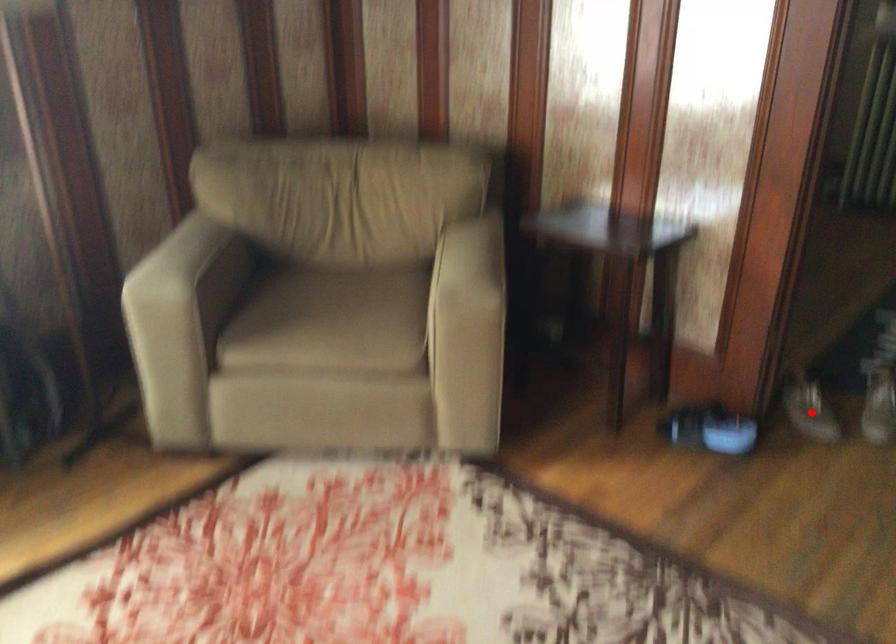
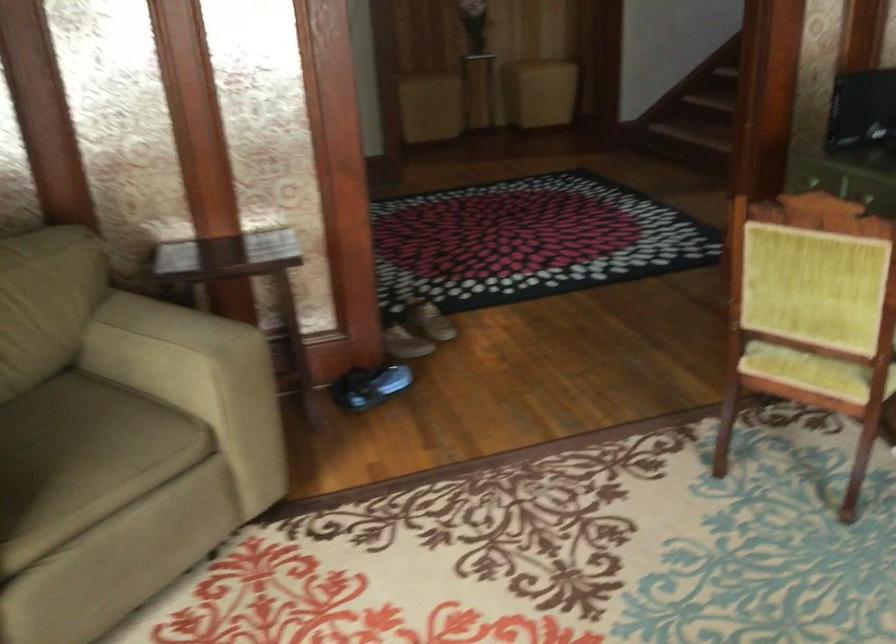
Question: I am providing you with two images of the same scene from different viewpoints. Image1 has a red point marked. In image2, the corresponding 3D location appears at what relative position? Reply with the corresponding letter.

Choices:
 (A) Closer
 (B) Farther

Answer: (B)